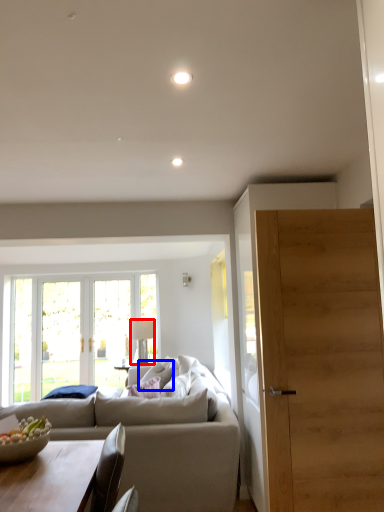
Question: Which point is further to the camera, lamp (highlighted by a red box) or pillow (highlighted by a blue box)?

Choices:
 (A) lamp
 (B) pillow

Answer: (A)